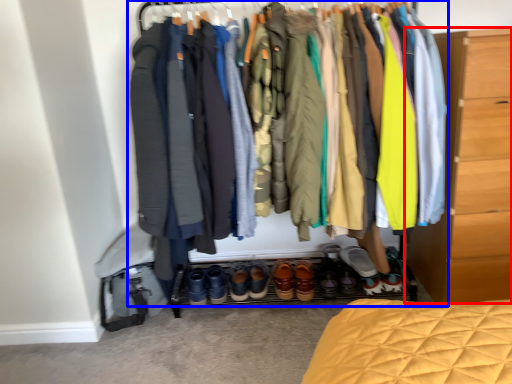
Question: Which of the following is the farthest to the observer, chest of drawers (highlighted by a red box) or closet (highlighted by a blue box)?

Choices:
 (A) chest of drawers
 (B) closet

Answer: (A)